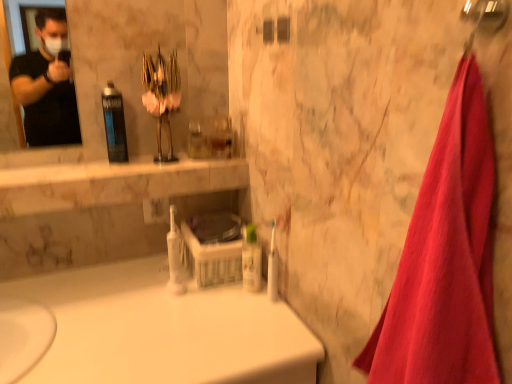
At what (x,y) coordinates should I click in order to perform the action: click on free space in front of white plastic toothbrush at center. Please return your answer as a coordinate pair (x, y). Looking at the image, I should click on (261, 342).